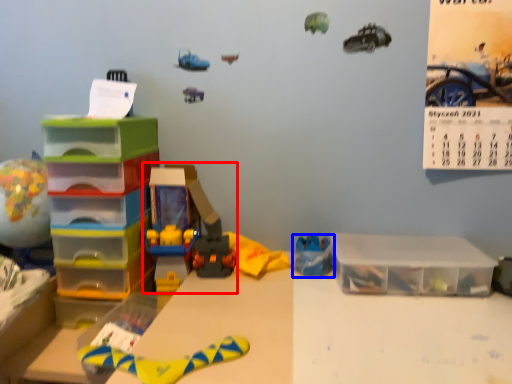
Question: Which object appears farthest to the camera in this image, toy (highlighted by a red box) or toy (highlighted by a blue box)?

Choices:
 (A) toy
 (B) toy

Answer: (B)